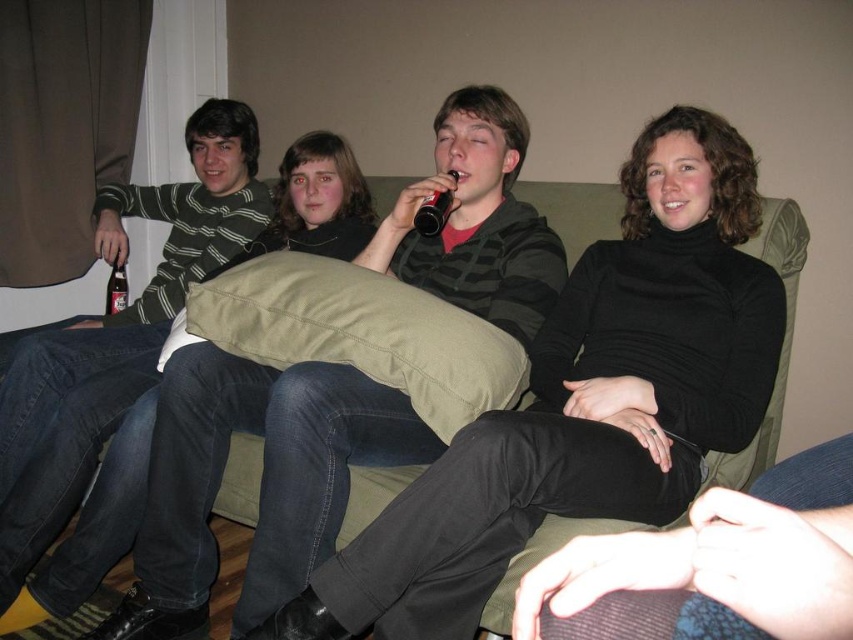
Is point (161, 556) positioned in front of point (448, 172)?

Yes.

You are a GUI agent. You are given a task and a screenshot of the screen. Output one action in this format:
    pyautogui.click(x=<x>, y=<y>)
    Task: Click on the matte black jacket at center
    The width and height of the screenshot is (853, 640).
    Given the screenshot: What is the action you would take?
    pyautogui.click(x=260, y=483)

You are a GUI agent. You are given a task and a screenshot of the screen. Output one action in this format:
    pyautogui.click(x=<x>, y=<y>)
    Task: Click on the matte black jacket at center
    
    Given the screenshot: What is the action you would take?
    pyautogui.click(x=260, y=483)

Who is shorter, black plastic can at center or bottle glass beer at left?

Standing shorter between the two is black plastic can at center.

Does point (436, 211) come behind point (115, 253)?

No, it is not.

This screenshot has width=853, height=640. Describe the element at coordinates (432, 212) in the screenshot. I see `black plastic can at center` at that location.

Find the location of `black plastic can at center`. black plastic can at center is located at coordinates (432, 212).

Image resolution: width=853 pixels, height=640 pixels. What do you see at coordinates (260, 483) in the screenshot?
I see `matte black jacket at center` at bounding box center [260, 483].

Is matte black jacket at center below striped cotton sweater at left?

Yes.

Looking at this image, who is more forward, (316, 378) or (206, 147)?

Point (316, 378) is in front.

Identify the location of matte black jacket at center. (260, 483).